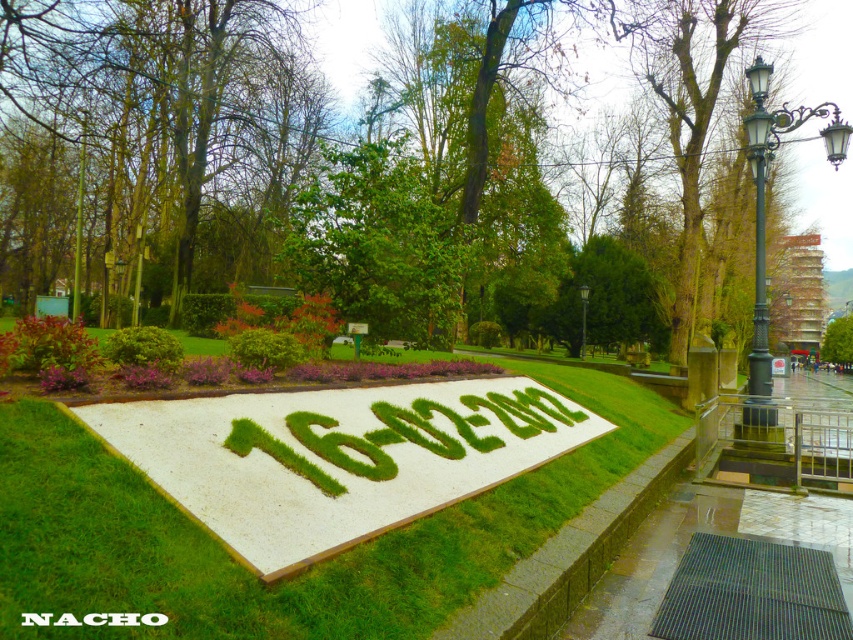
Question: Which point is closer to the camera taking this photo?

Choices:
 (A) (112, 616)
 (B) (581, 339)
 (C) (318, 314)

Answer: (A)

Question: Estimate the real-world distances between objects in this image. Which object is farther from the black text at center?

Choices:
 (A) green grass at center
 (B) green leafy tree at center
 (C) vivid red leaves at center
 (D) black metal lamp post at upper center

Answer: (B)

Question: Can you confirm if black metal lamp post at right is positioned to the right of vivid red leaves at center?

Choices:
 (A) no
 (B) yes

Answer: (B)

Question: Is black metal streetlight at right positioned before black text at center?

Choices:
 (A) no
 (B) yes

Answer: (A)

Question: Considering the relative positions of vivid red leaves at center and green leafy bush at upper left in the image provided, where is vivid red leaves at center located with respect to green leafy bush at upper left?

Choices:
 (A) above
 (B) below

Answer: (A)

Question: Which point is closer to the camera taking this photo?

Choices:
 (A) (131, 625)
 (B) (804, 116)
 (C) (248, 326)

Answer: (A)